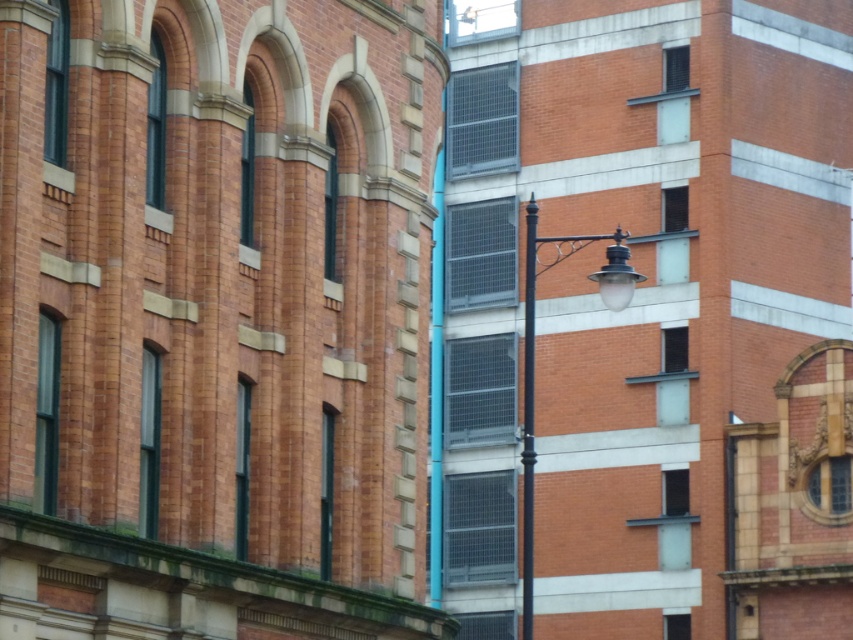
You are a delivery person trying to navigate between the two buildings. You see a black metal lamp post at center and a black wrought iron pole at center. Which object is higher up in the image?

The black metal lamp post at center is above the black wrought iron pole at center, so it is higher up in the image.

You are standing at the entrance of the older building on the left and want to walk directly towards the modern building on the right. Is the black metal lamp post at center in your path?

The black metal lamp post at center is located at point [532,355]. Since you are walking from the older building on the left towards the modern building on the right, the lamp post is positioned centrally between them, so it would be in your path.